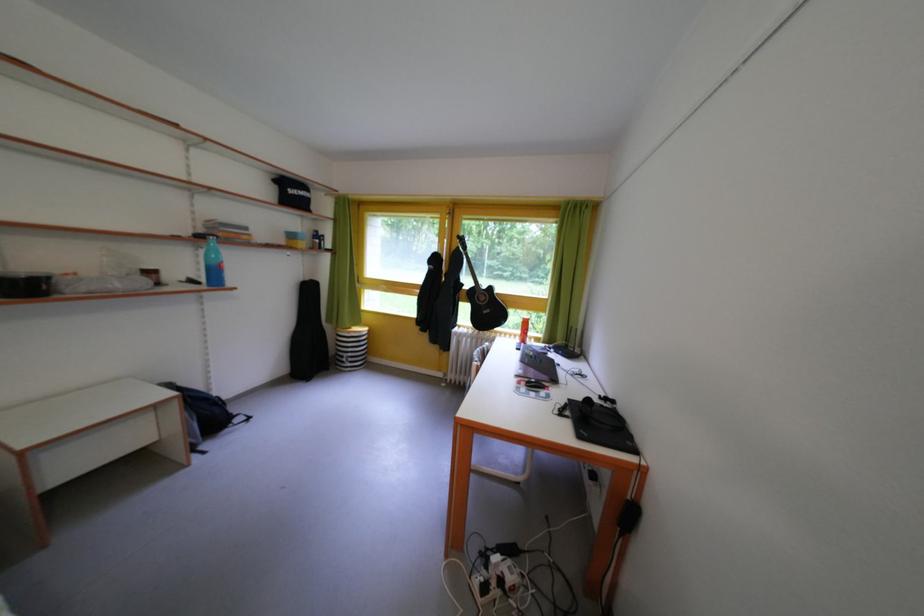
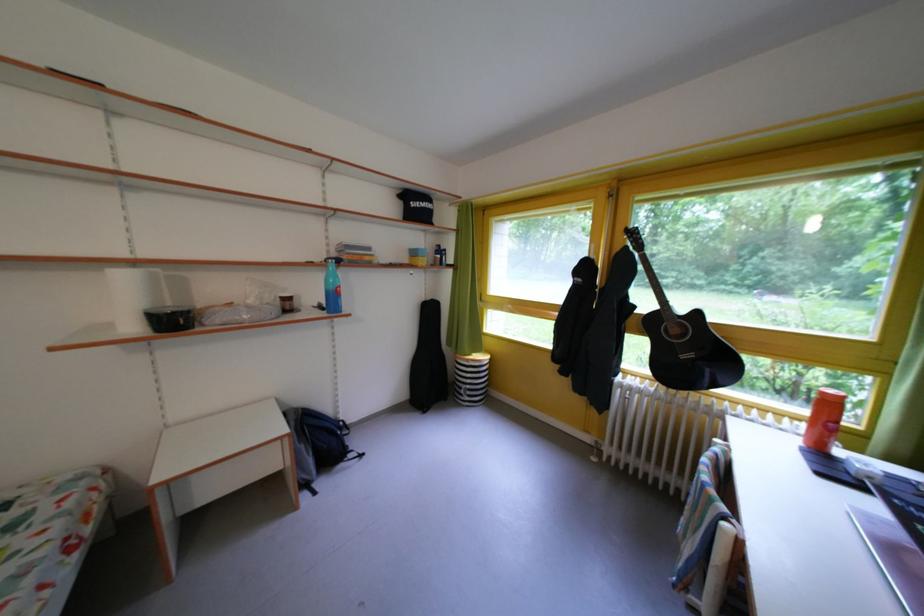
In the second image, find the point that corresponds to the point at 202,286 in the first image.

(331, 313)